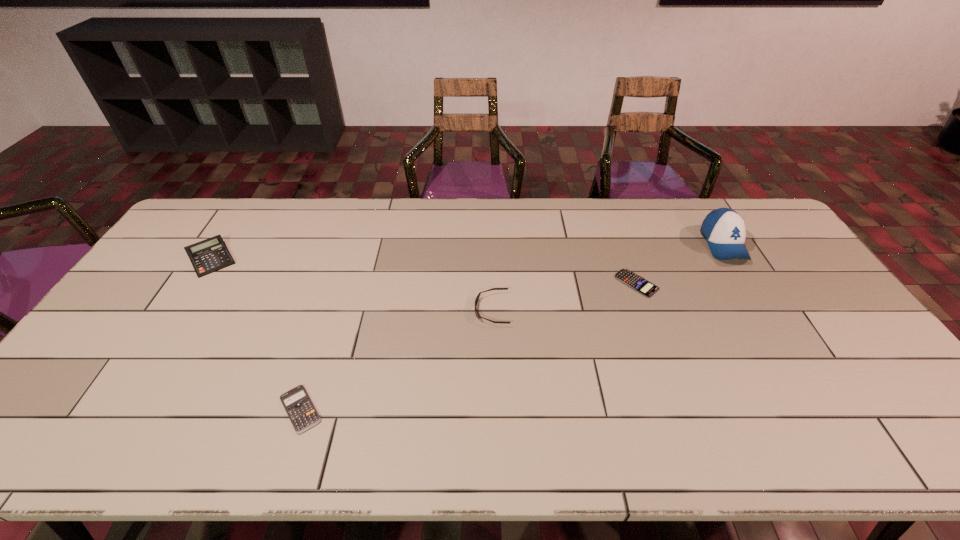
At what (x,y) coordinates should I click in order to perform the action: click on free space located 0.320m on the front of the tallest calculator. Please return your answer as a coordinate pair (x, y). Looking at the image, I should click on (142, 365).

Where is `vacant space located 0.180m on the front-facing side of the third shortest object`? vacant space located 0.180m on the front-facing side of the third shortest object is located at coordinates (412, 309).

The height and width of the screenshot is (540, 960). I want to click on vacant space located on the front-facing side of the third shortest object, so click(x=420, y=309).

Where is `blank area located 0.280m on the front-facing side of the third shortest object`? Image resolution: width=960 pixels, height=540 pixels. blank area located 0.280m on the front-facing side of the third shortest object is located at coordinates (377, 309).

You are a GUI agent. You are given a task and a screenshot of the screen. Output one action in this format:
    pyautogui.click(x=<x>, y=<y>)
    Task: Click on the vacant space located 0.260m on the right of the rightmost calculator
    The image size is (960, 540).
    Given the screenshot: What is the action you would take?
    pyautogui.click(x=742, y=284)

In order to click on vacant area situated on the back of the nearest object in this screenshot , I will do `click(335, 300)`.

The height and width of the screenshot is (540, 960). Find the location of `object present at the far edge`. object present at the far edge is located at coordinates (724, 229).

At what (x,y) coordinates should I click in order to perform the action: click on object located at the near edge. Please return your answer as a coordinate pair (x, y). The image size is (960, 540). Looking at the image, I should click on (303, 415).

Where is `object present at the left edge`? object present at the left edge is located at coordinates (210, 255).

What are the coordinates of `object that is at the right edge` in the screenshot? It's located at (724, 229).